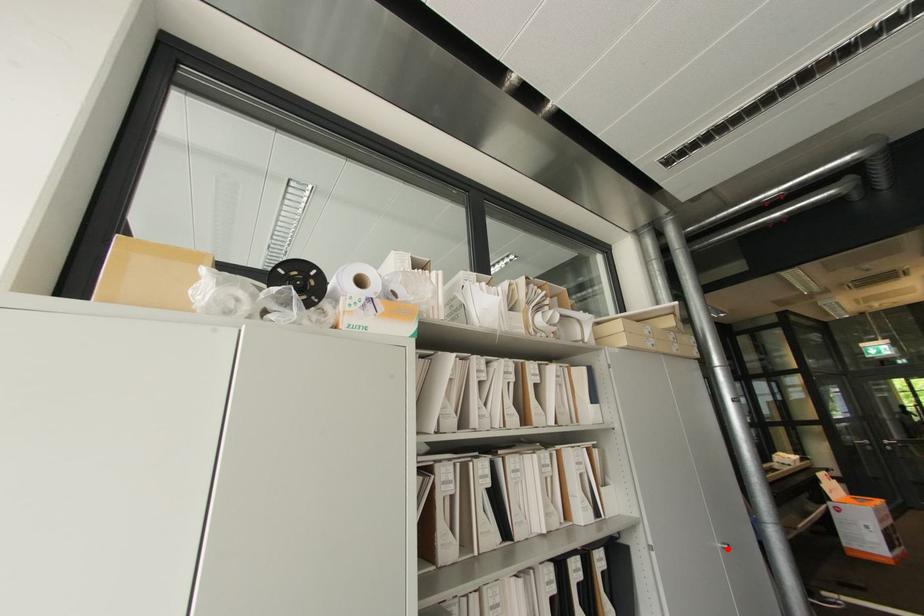
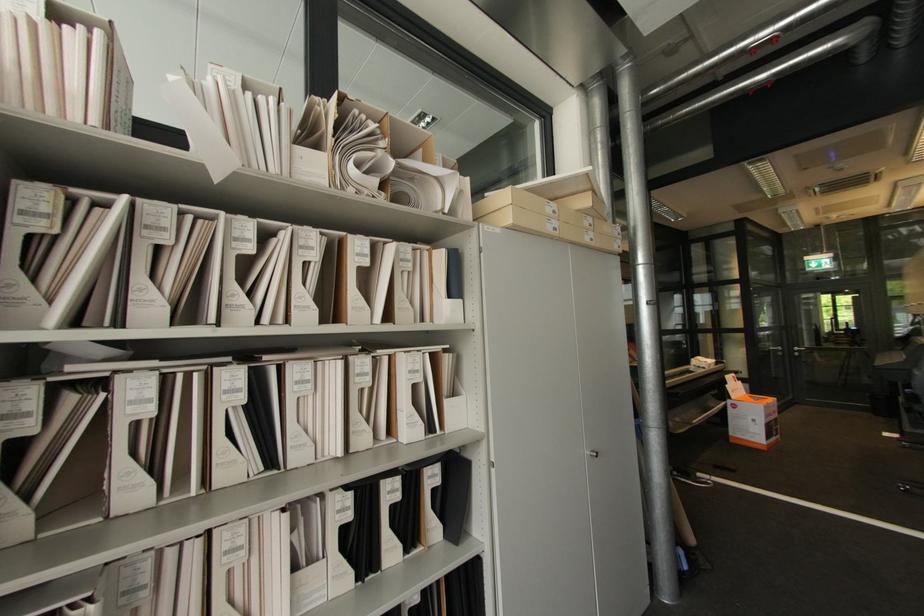
The point at the highlighted location is marked in the first image. Where is the corresponding point in the second image?

(596, 456)